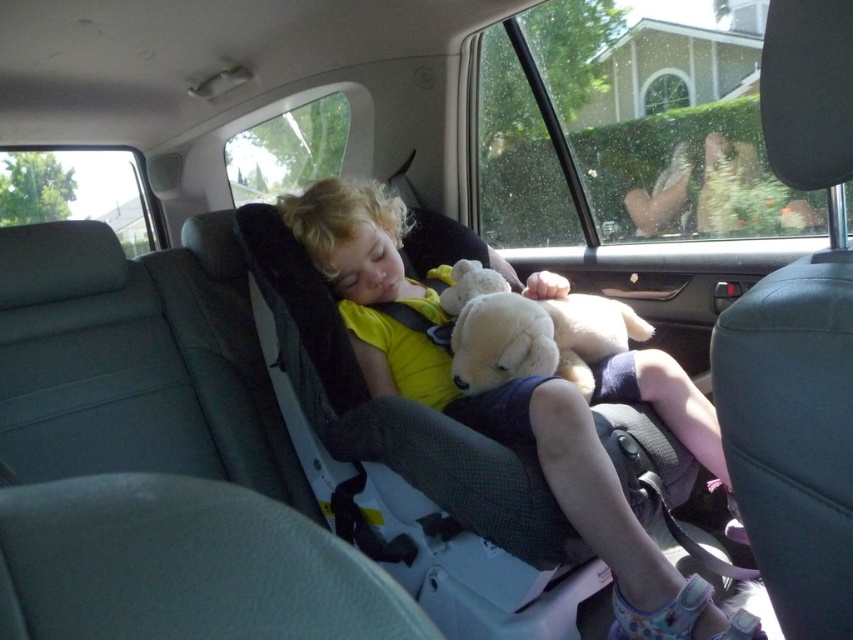
Question: Does yellow fabric child at center appear under white plush teddy bear at center?

Choices:
 (A) yes
 (B) no

Answer: (A)

Question: Which of the following is the closest to the observer?

Choices:
 (A) (608, 524)
 (B) (569, 316)

Answer: (A)

Question: In this image, where is yellow fabric child at center located relative to white plush teddy bear at center?

Choices:
 (A) left
 (B) right

Answer: (A)

Question: Which point is farther to the camera?

Choices:
 (A) (332, 198)
 (B) (556, 348)

Answer: (A)

Question: Can you confirm if yellow fabric child at center is positioned below white plush teddy bear at center?

Choices:
 (A) no
 (B) yes

Answer: (B)

Question: Which of the following is the farthest from the observer?

Choices:
 (A) yellow fabric child at center
 (B) white plush teddy bear at center

Answer: (B)